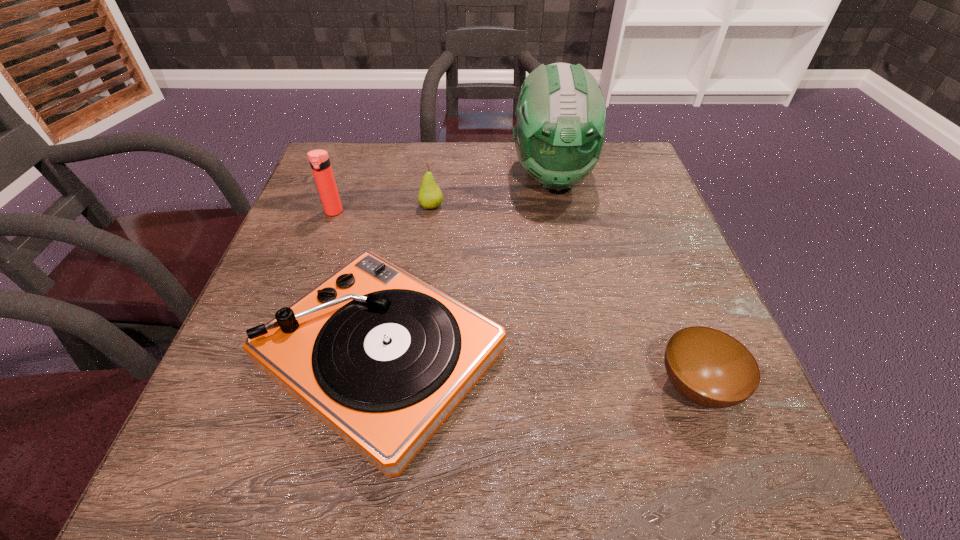
You are a GUI agent. You are given a task and a screenshot of the screen. Output one action in this format:
    pyautogui.click(x=<x>, y=<y>)
    Task: Click on the vacant space at the left edge of the desktop
    This screenshot has width=960, height=540.
    Given the screenshot: What is the action you would take?
    pyautogui.click(x=343, y=211)

Locate an element on the screen. The width and height of the screenshot is (960, 540). vacant space at the right edge of the desktop is located at coordinates (614, 228).

This screenshot has width=960, height=540. I want to click on vacant space at the far left corner, so click(x=312, y=186).

This screenshot has height=540, width=960. Identify the location of vacant space at the near left corner. (198, 462).

In the image, there is a desktop. Identify the location of free space at the far right corner. The height and width of the screenshot is (540, 960). (640, 160).

I want to click on unoccupied position between the thermos bottle and the third shortest object, so click(x=382, y=210).

Identify the location of vacant space that is in between the fourth shortest object and the third shortest object. (382, 210).

You are a GUI agent. You are given a task and a screenshot of the screen. Output one action in this format:
    pyautogui.click(x=<x>, y=<y>)
    Task: Click on the blank region between the fourth shortest object and the pear
    
    Given the screenshot: What is the action you would take?
    pyautogui.click(x=382, y=210)

I want to click on vacant space that's between the bowl and the record player, so click(x=539, y=372).

You are a GUI agent. You are given a task and a screenshot of the screen. Output one action in this format:
    pyautogui.click(x=<x>, y=<y>)
    Task: Click on the vacant space that's between the bowl and the third tallest object
    This screenshot has width=960, height=540.
    Given the screenshot: What is the action you would take?
    pyautogui.click(x=564, y=297)